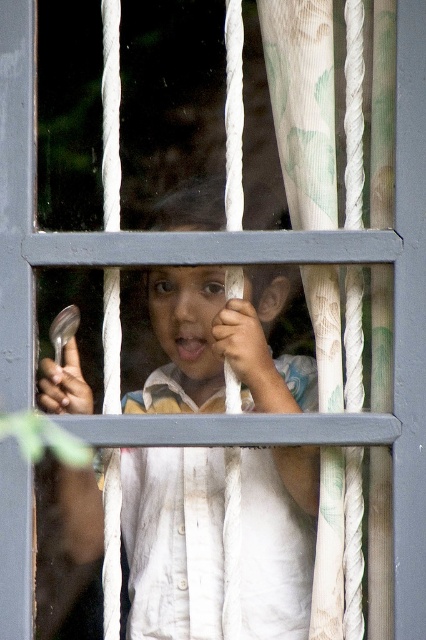
Who is shorter, white cotton shirt at center or white textured curtain at right?

With less height is white cotton shirt at center.

This screenshot has height=640, width=426. Describe the element at coordinates (221, 342) in the screenshot. I see `white cotton shirt at center` at that location.

Locate an element on the screen. The height and width of the screenshot is (640, 426). white cotton shirt at center is located at coordinates (221, 342).